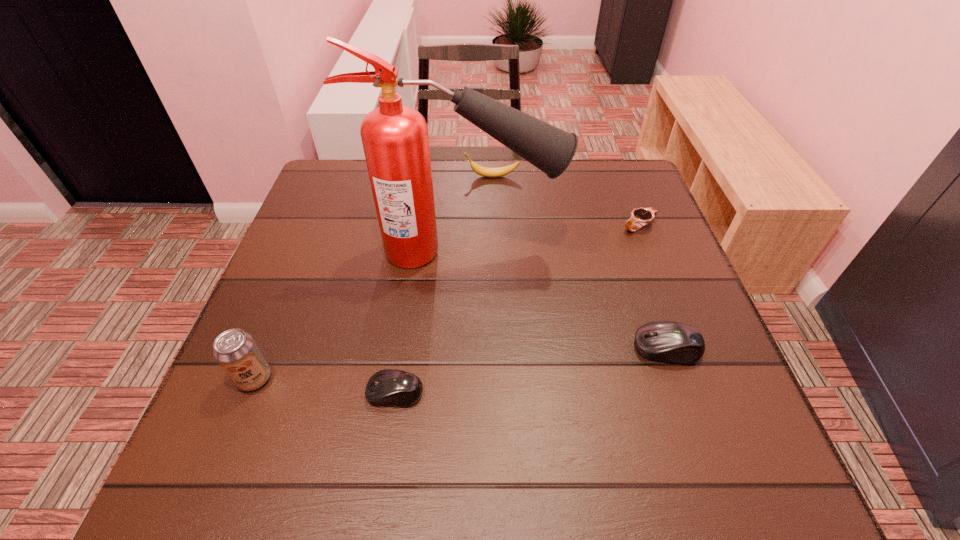
Locate an element on the screen. Image resolution: width=960 pixels, height=540 pixels. the shorter mouse is located at coordinates (390, 387).

You are a GUI agent. You are given a task and a screenshot of the screen. Output one action in this format:
    pyautogui.click(x=<x>, y=<y>)
    Task: Click on the nearer mouse
    
    Given the screenshot: What is the action you would take?
    pyautogui.click(x=390, y=387)

You are a GUI agent. You are given a task and a screenshot of the screen. Output one action in this format:
    pyautogui.click(x=<x>, y=<y>)
    Task: Click on the taller mouse
    The image size is (960, 540).
    Given the screenshot: What is the action you would take?
    pyautogui.click(x=666, y=341)

Where is `the third shortest object`? the third shortest object is located at coordinates (666, 341).

I want to click on banana, so click(x=480, y=170).

Where is `the third tallest object`? The image size is (960, 540). the third tallest object is located at coordinates (480, 170).

Where is `watch`? Image resolution: width=960 pixels, height=540 pixels. watch is located at coordinates (641, 216).

Where is `the tallest object`? Image resolution: width=960 pixels, height=540 pixels. the tallest object is located at coordinates (395, 139).

Where is `the leftmost object`? The width and height of the screenshot is (960, 540). the leftmost object is located at coordinates (235, 350).

Locate an element on the screen. The height and width of the screenshot is (540, 960). the fifth shortest object is located at coordinates (235, 350).